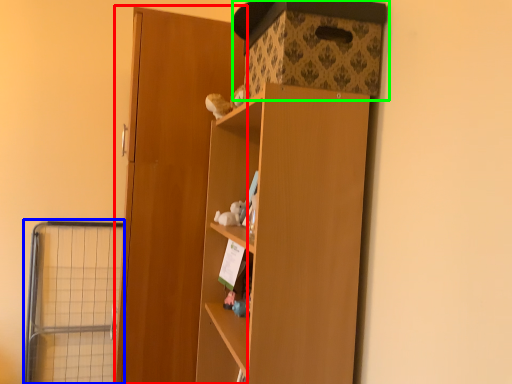
Question: Which is farther away from door (highlighted by a red box)? cage (highlighted by a blue box) or storage box (highlighted by a green box)?

Choices:
 (A) cage
 (B) storage box

Answer: (A)